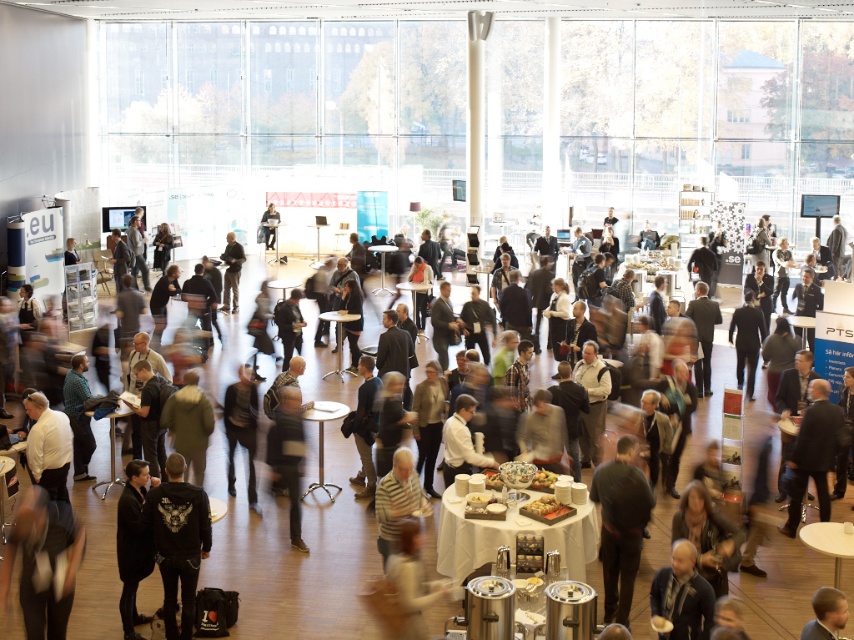
Measure the distance between black matte jacket at lower left and dark gray suit at center.

57.57 feet

What do you see at coordinates (178, 541) in the screenshot? I see `black matte jacket at lower left` at bounding box center [178, 541].

Where is `black matte jacket at lower left`? The height and width of the screenshot is (640, 854). black matte jacket at lower left is located at coordinates (178, 541).

Between dark gray sweater at center and dark gray suit at center, which one is positioned lower?

Positioned lower is dark gray sweater at center.

This screenshot has width=854, height=640. Find the location of `dark gray sweater at center`. dark gray sweater at center is located at coordinates (287, 456).

I want to click on dark gray sweater at center, so click(x=287, y=456).

Is the position of black matte jacket at lower left more distant than that of dark brown leather jacket at center?

No, black matte jacket at lower left is closer to the viewer.

This screenshot has height=640, width=854. What do you see at coordinates (178, 541) in the screenshot?
I see `black matte jacket at lower left` at bounding box center [178, 541].

Where is `black matte jacket at lower left`? black matte jacket at lower left is located at coordinates (178, 541).